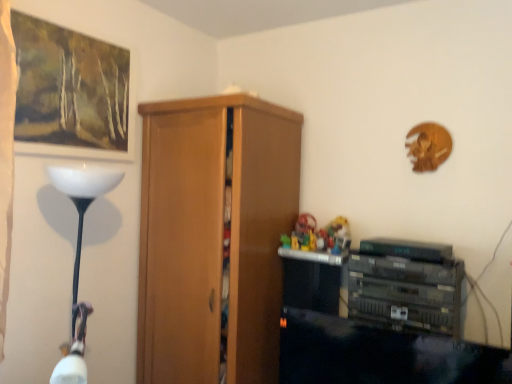
Question: From the image's perspective, does matte wooden picture frame at upper left appear lower than wooden cupboard at center?

Choices:
 (A) no
 (B) yes

Answer: (A)

Question: Is matte wooden picture frame at upper left touching wooden cupboard at center?

Choices:
 (A) yes
 (B) no

Answer: (B)

Question: Does matte wooden picture frame at upper left have a greater height compared to wooden cupboard at center?

Choices:
 (A) no
 (B) yes

Answer: (A)

Question: Is matte wooden picture frame at upper left oriented towards wooden cupboard at center?

Choices:
 (A) no
 (B) yes

Answer: (A)

Question: Does matte wooden picture frame at upper left come behind wooden cupboard at center?

Choices:
 (A) yes
 (B) no

Answer: (B)

Question: Is wooden cupboard at center inside matte wooden picture frame at upper left?

Choices:
 (A) yes
 (B) no

Answer: (B)

Question: Does wooden cupboard at center have a lesser height compared to multicolored plastic toys at center?

Choices:
 (A) no
 (B) yes

Answer: (A)

Question: Is wooden cupboard at center not inside multicolored plastic toys at center?

Choices:
 (A) yes
 (B) no

Answer: (A)

Question: Is multicolored plastic toys at center located within wooden cupboard at center?

Choices:
 (A) no
 (B) yes

Answer: (A)

Question: Is wooden cupboard at center in contact with multicolored plastic toys at center?

Choices:
 (A) yes
 (B) no

Answer: (B)

Question: Considering the relative sizes of wooden cupboard at center and multicolored plastic toys at center in the image provided, is wooden cupboard at center taller than multicolored plastic toys at center?

Choices:
 (A) yes
 (B) no

Answer: (A)

Question: Can you confirm if wooden cupboard at center is bigger than multicolored plastic toys at center?

Choices:
 (A) no
 (B) yes

Answer: (B)

Question: Considering the relative sizes of multicolored plastic toys at center and matte wooden picture frame at upper left in the image provided, is multicolored plastic toys at center bigger than matte wooden picture frame at upper left?

Choices:
 (A) no
 (B) yes

Answer: (A)